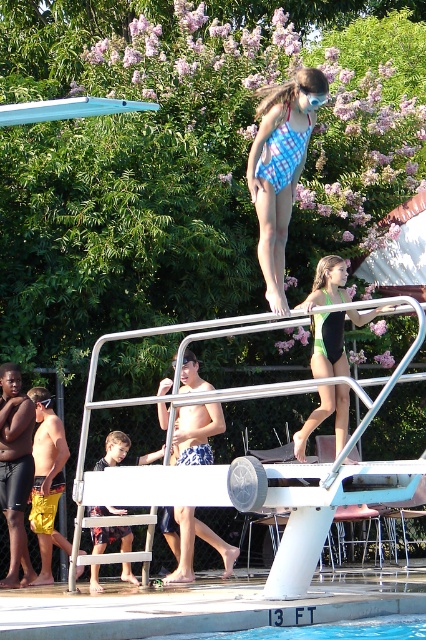
You are standing at the edge of the pool and see two people in the water. One is wearing a blue plaid swimsuit at center and the other has dark blue shorts at center. Which swimmer is closer to you?

The blue plaid swimsuit at center is closer to the viewer than dark blue shorts at center.

You are a swimmer standing at the edge of the pool and want to jump into the blue smooth water at lower center. To avoid hitting the white metal rail at center, which direction should you aim for when jumping?

You should aim towards the blue smooth water at lower center because the white metal rail at center is closer to you than the water, so jumping towards the water will avoid collision.